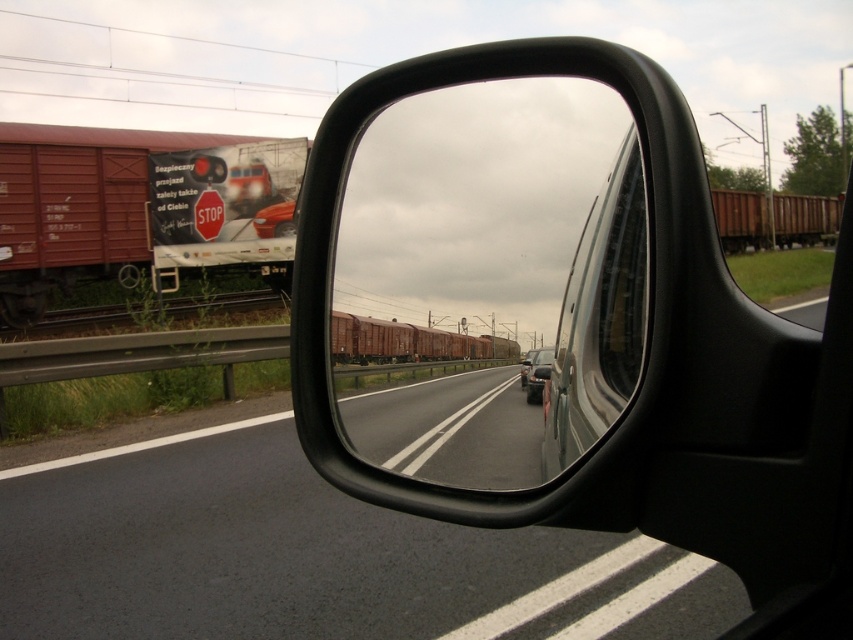
Question: Can you confirm if red matte freight car at left is wider than transparent glass car window at center?

Choices:
 (A) no
 (B) yes

Answer: (B)

Question: Which point appears closest to the camera in this image?

Choices:
 (A) (341, 358)
 (B) (135, 266)
 (C) (189, 273)

Answer: (A)

Question: Which point is closer to the camera?

Choices:
 (A) red matte freight car at left
 (B) transparent glass car window at center

Answer: (B)

Question: Which point is closer to the camera?

Choices:
 (A) (206, 220)
 (B) (584, 164)

Answer: (B)

Question: Is red corrugated metal train at left bigger than shiny silver car at center?

Choices:
 (A) no
 (B) yes

Answer: (B)

Question: Is black plastic mirror at center positioned behind rusty metal train at center?

Choices:
 (A) no
 (B) yes

Answer: (A)